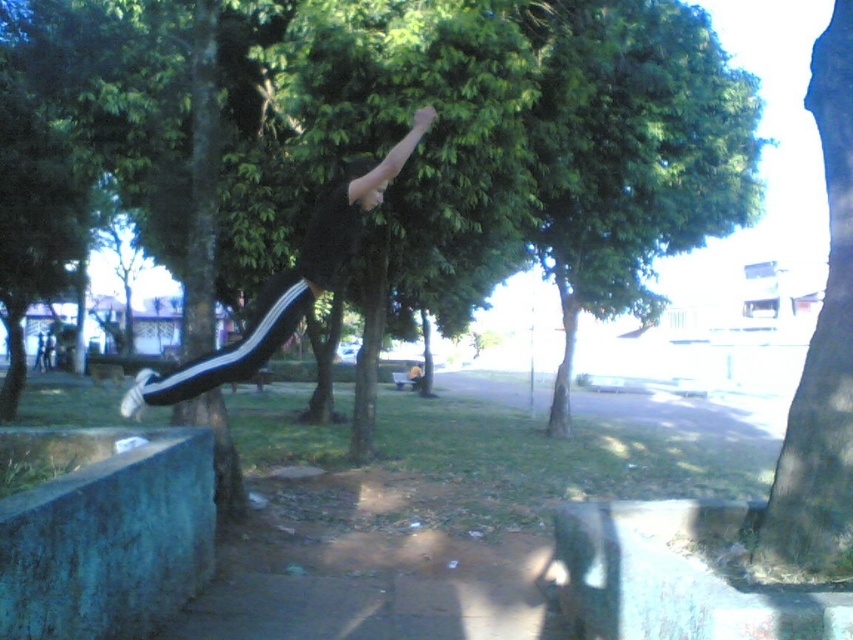
Question: Among these points, which one is farthest from the camera?

Choices:
 (A) (677, 145)
 (B) (828, 224)
 (C) (138, 396)

Answer: (A)

Question: Is green leafy tree at center wider than black matte track pants at center?

Choices:
 (A) no
 (B) yes

Answer: (B)

Question: Estimate the real-world distances between objects in this image. Which object is closer to the green leafy tree at right?

Choices:
 (A) green leafy tree at center
 (B) black matte track pants at center

Answer: (B)

Question: Where is green leafy tree at right located in relation to black matte track pants at center in the image?

Choices:
 (A) below
 (B) above

Answer: (A)

Question: Among these points, which one is nearest to the camera?

Choices:
 (A) (724, 92)
 (B) (248, 348)

Answer: (B)

Question: In this image, where is green leafy tree at center located relative to black matte track pants at center?

Choices:
 (A) right
 (B) left

Answer: (A)